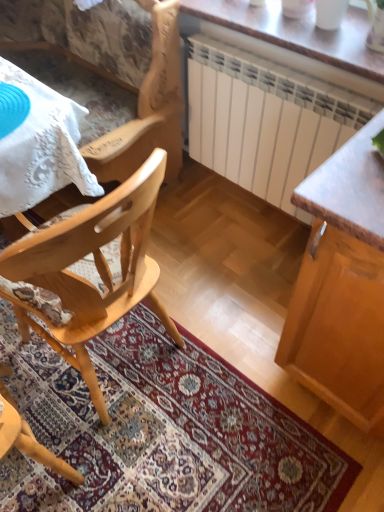
You are a GUI agent. You are given a task and a screenshot of the screen. Output one action in this format:
    pyautogui.click(x=<x>, y=<y>)
    Task: Click on the vacant space that's between wooden cabinet at right and carpeted mat at center
    
    Given the screenshot: What is the action you would take?
    pyautogui.click(x=228, y=296)